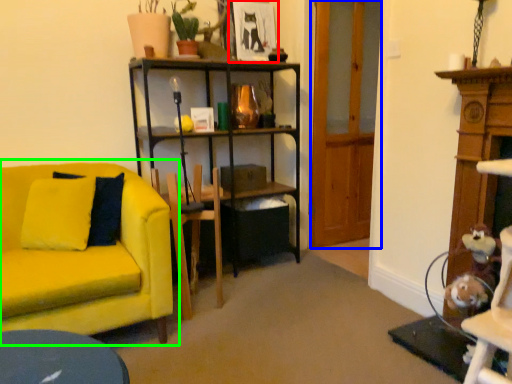
Question: Which object is the closest to the picture frame (highlighted by a red box)? Choose among these: glass door (highlighted by a blue box) or studio couch (highlighted by a green box).

Choices:
 (A) glass door
 (B) studio couch

Answer: (A)